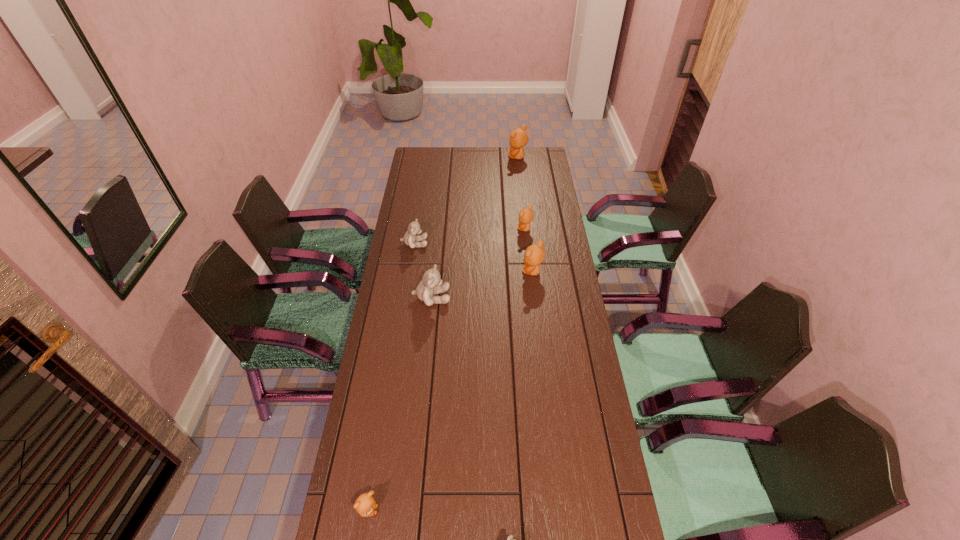
Locate an element on the screen. The width and height of the screenshot is (960, 540). free location at the far right corner is located at coordinates (537, 160).

The image size is (960, 540). I want to click on free space between the fourth farthest teddy bear and the second smallest gray teddy bear, so click(473, 258).

I want to click on unoccupied position between the fifth nearest teddy bear and the sixth farthest teddy bear, so click(392, 377).

This screenshot has width=960, height=540. Find the location of `free space between the nearest brown teddy bear and the biggest gray teddy bear`. free space between the nearest brown teddy bear and the biggest gray teddy bear is located at coordinates click(399, 404).

Where is `empty space between the sixth nearest object and the fifth farthest teddy bear`? This screenshot has width=960, height=540. empty space between the sixth nearest object and the fifth farthest teddy bear is located at coordinates (478, 263).

Where is `object that can be found as the third closest to the second farthest object`? object that can be found as the third closest to the second farthest object is located at coordinates (431, 284).

Identify the location of object that ranks as the fifth closest to the second nearest object. The height and width of the screenshot is (540, 960). (526, 215).

In order to click on teddy bear that is the third closest one to the fifth nearest object in this screenshot , I will do `click(534, 255)`.

Identify which teddy bear is the third nearest to the third smallest brown teddy bear. Please provide its 2D coordinates. Your answer should be formatted as a tuple, i.e. [(x, y)], where the tuple contains the x and y coordinates of a point satisfying the conditions above.

[(410, 238)]

At what (x,y) coordinates should I click in order to perform the action: click on the closest brown teddy bear to the biggest brown teddy bear. Please return your answer as a coordinate pair (x, y). The width and height of the screenshot is (960, 540). Looking at the image, I should click on (526, 215).